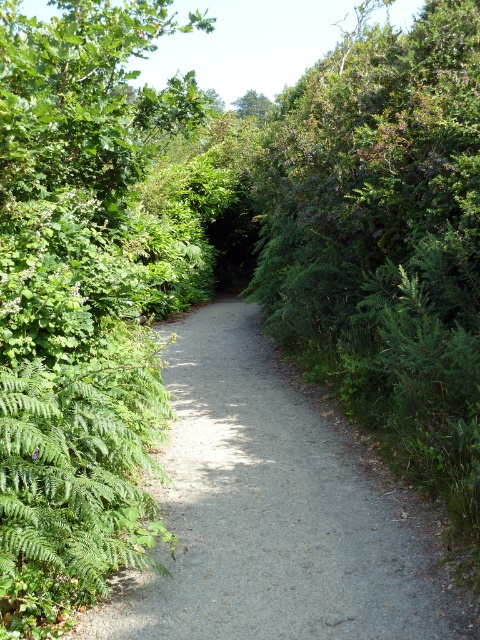
You are a hiker who wants to take a photo of the gray gravel path at center and the green leafy tree at upper center. Which object is shorter in the image?

The gray gravel path at center is not as tall as the green leafy tree at upper center, so the gray gravel path at center is shorter.

You are a hiker carrying a heavy backpack and need to walk along the gray gravel path at center. There is a green leafy tree at upper center nearby. Which object is closer to you as you stand on the path?

The gray gravel path at center is closer to the viewer than the green leafy tree at upper center, so the gray gravel path at center is closer to you.

You are a gardener with a 1.2 meter wide lawnmower. You need to mow the gray gravel path at center and the green leafy tree at upper center. Which area can your lawnmower fit into?

The gray gravel path at center is thinner than the green leafy tree at upper center, so the lawnmower can fit into the green leafy tree at upper center area since it is wider than the path.